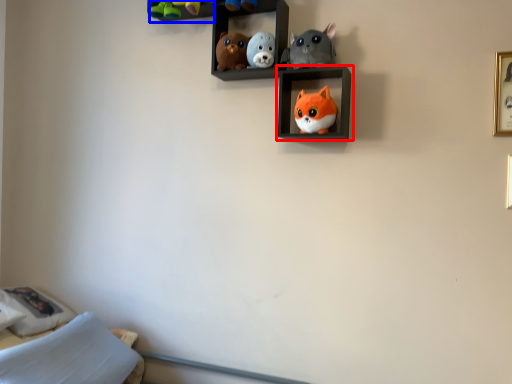
Question: Which point is closer to the camera, shelf (highlighted by a red box) or cabinet (highlighted by a blue box)?

Choices:
 (A) shelf
 (B) cabinet

Answer: (A)